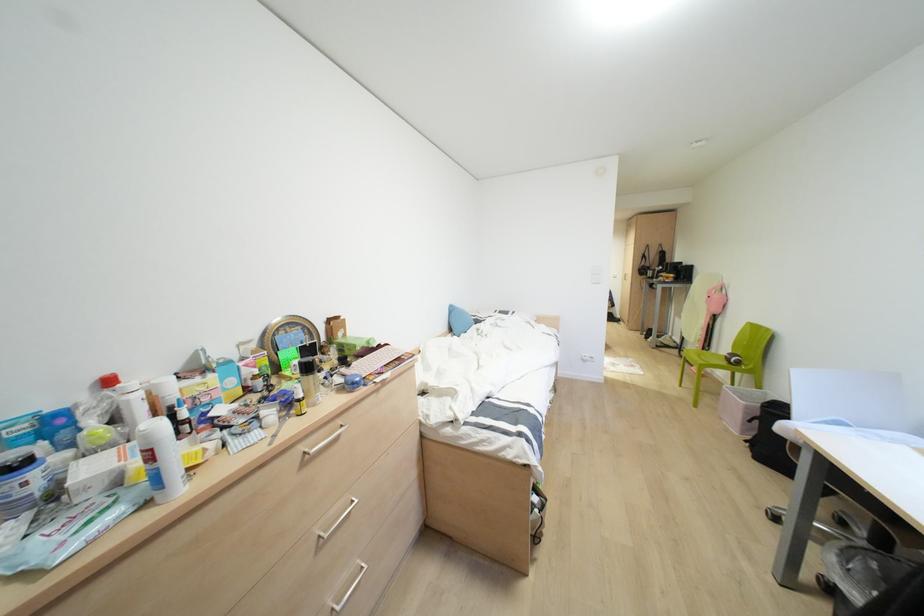
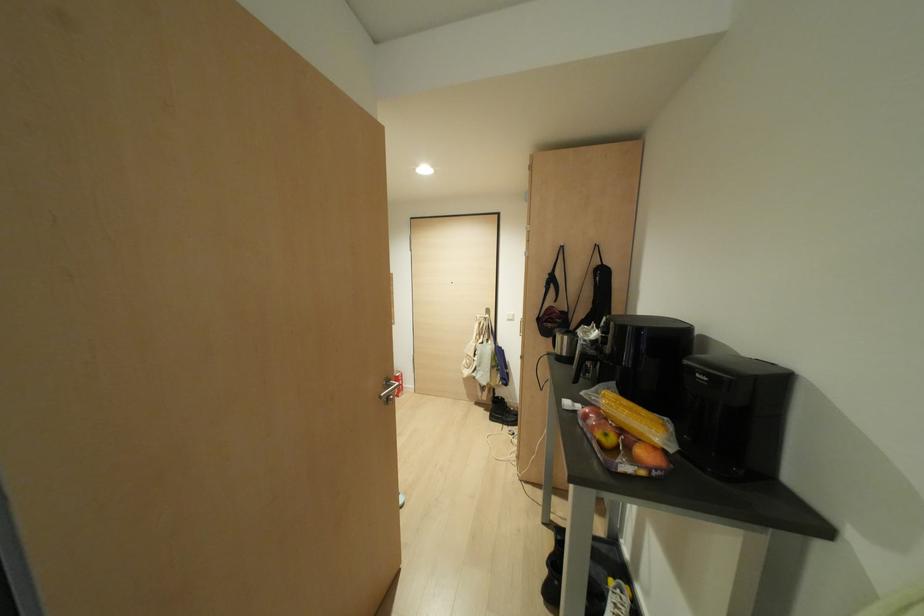
Locate, in the second image, the point that corresponds to pixel 642 256 in the first image.

(551, 280)